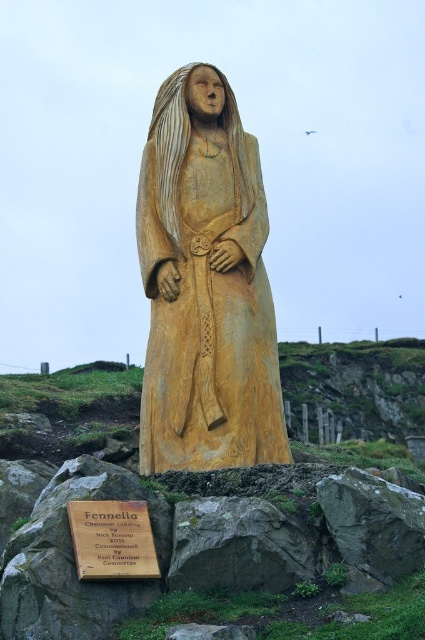
Question: Considering the relative positions of wooden statue at center and wooden plaque at lower center in the image provided, where is wooden statue at center located with respect to wooden plaque at lower center?

Choices:
 (A) above
 (B) below

Answer: (A)

Question: Does wooden statue at center have a larger size compared to wooden plaque at lower center?

Choices:
 (A) yes
 (B) no

Answer: (A)

Question: Which object is closer to the camera taking this photo?

Choices:
 (A) wooden statue at center
 (B) wooden plaque at lower center

Answer: (B)

Question: Does wooden statue at center lie in front of wooden plaque at lower center?

Choices:
 (A) no
 (B) yes

Answer: (A)